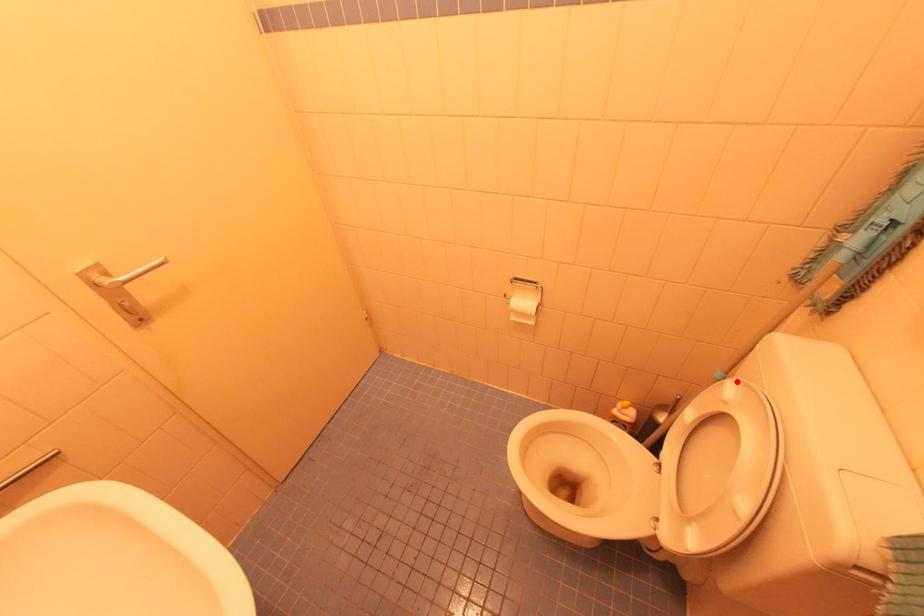
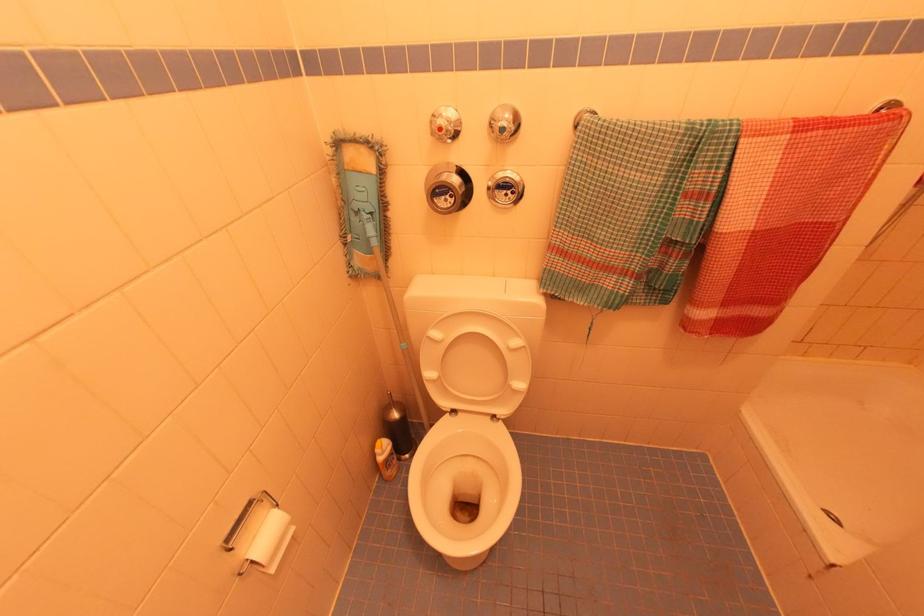
Question: I am providing you with two images of the same scene from different viewpoints. A red point is shown in image1. For the corresponding object point in image2, is it positioned nearer or farther from the camera?

Choices:
 (A) Nearer
 (B) Farther

Answer: (B)